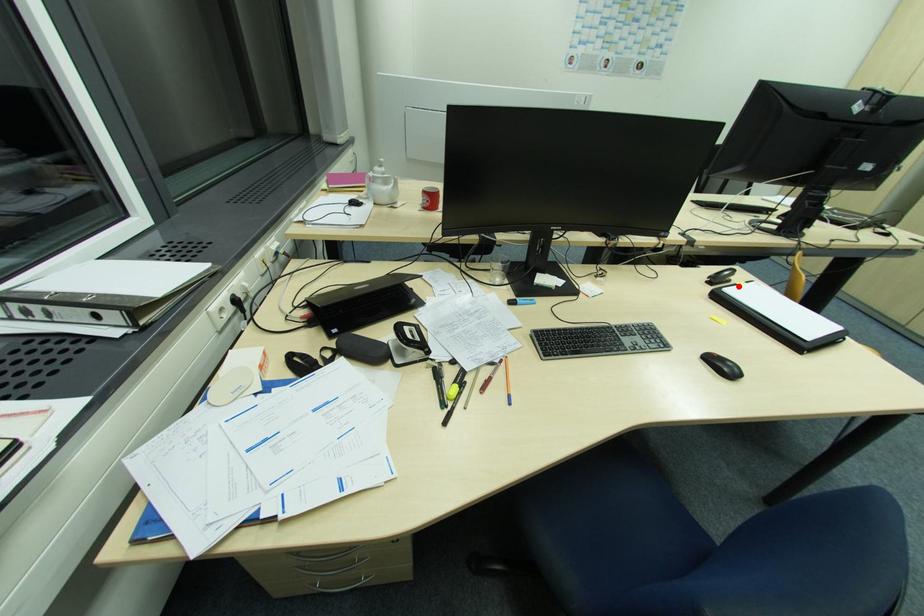
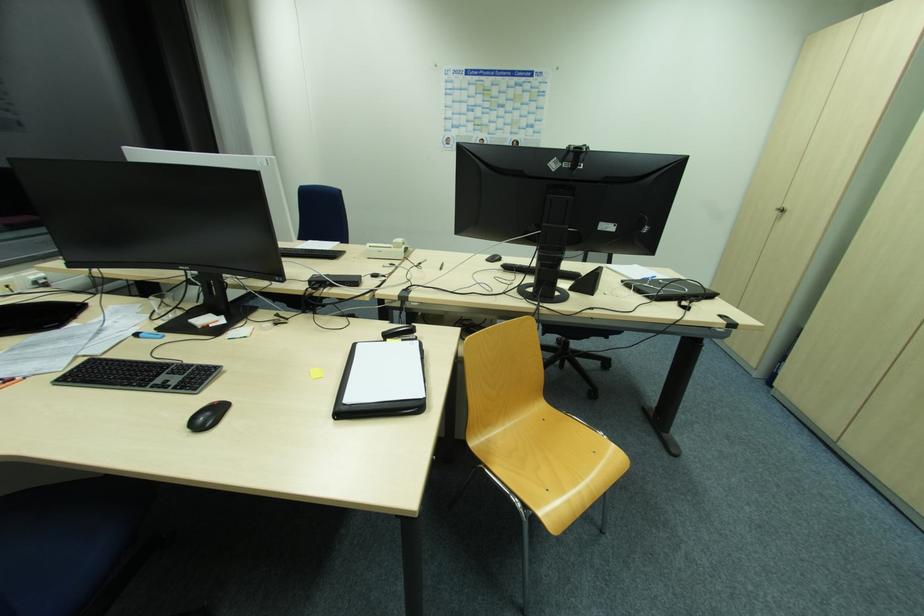
Find the pixel in the second image that matches the highlighted location in the first image.

(387, 342)